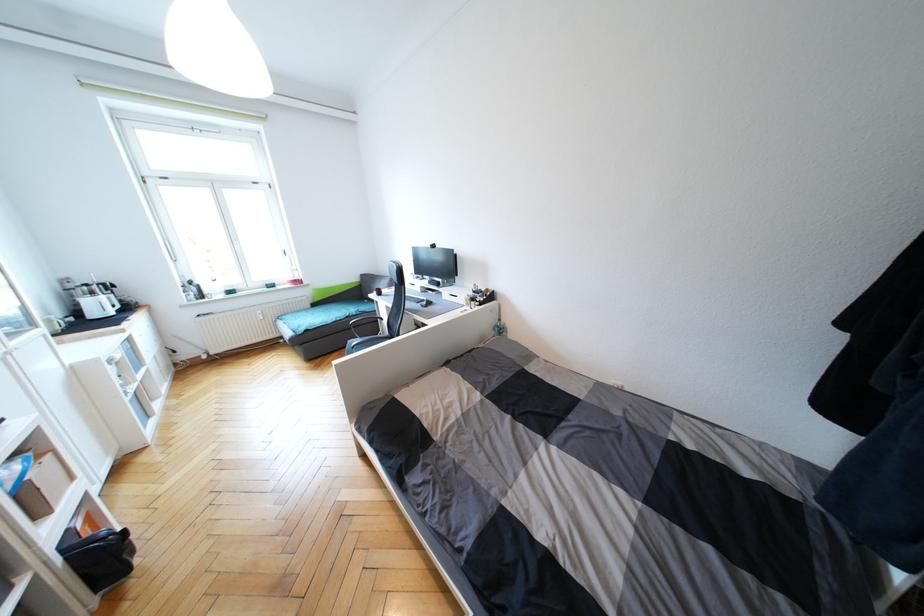
Find where to push the toaster lever. Please return your answer as a coordinate pair (x, y).

(122, 314)